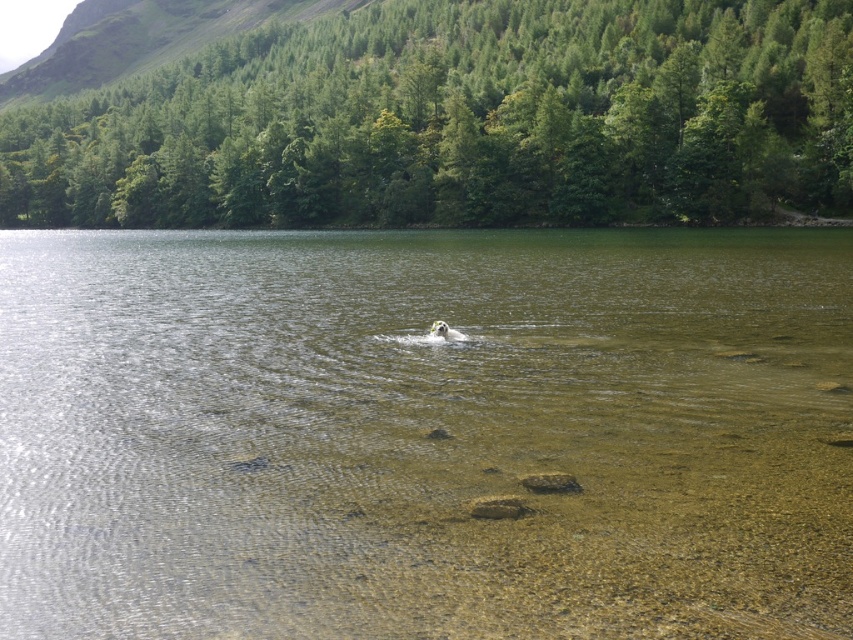
You are standing on the shore of the lake and see the clear water at center and the white fluffy dog at center. Which object is higher in the scene?

The clear water at center is taller than the white fluffy dog at center.

Consider the image. You are a photographer standing at the edge of the lake. You want to take a photo of the white fluffy dog at center while ensuring the clear water at center is visible in the background. Given the distance between them, is it possible to capture both in a single frame without moving your position?

The clear water at center and white fluffy dog at center are 57.09 feet apart. Since the distance is significant, it might be challenging to capture both in a single frame without moving your position. Adjusting the camera to a wider angle could help include both elements in the shot.

You are a photographer trying to capture the white fluffy dog at center in the clear water at center. Since the water is clear, will the dog be easily visible from the shore?

The clear water at center is bigger than the white fluffy dog at center, so the dog will be easily visible from the shore because the water clarity allows for better visibility of the dog.